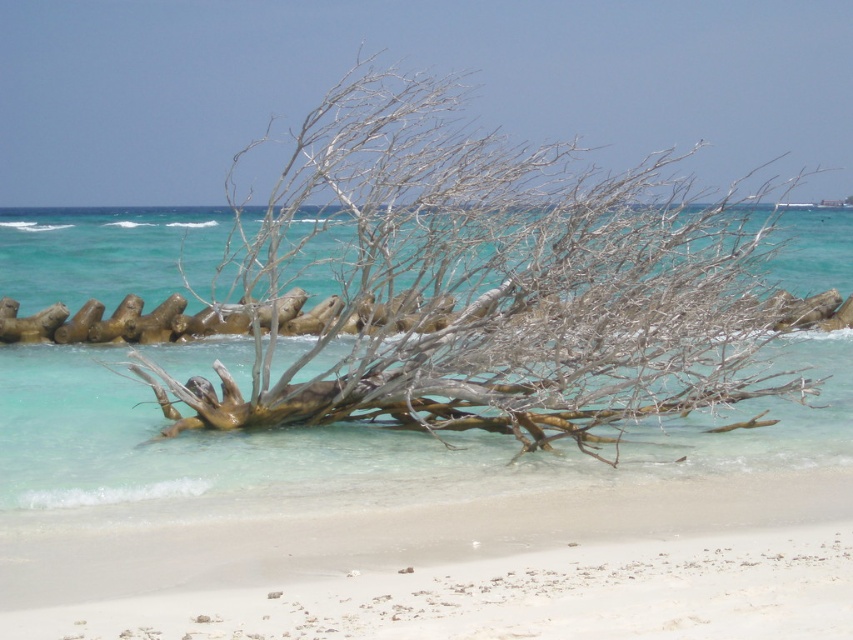
You are a lifeguard standing on the white sandy beach at lower center. You need to quickly reach the gray wood tree at center to retrieve a swimmer stranded there. Considering the width of the beach and the tree, can you safely walk directly to the tree without entering the water?

The gray wood tree at center is wider than the white sandy beach at lower center, so the tree likely extends beyond the beach area. Since the beach is narrower than the tree, walking directly to the tree may require stepping into the water where the beach ends. However, the tree is positioned at the waterline, so part of it might still be on the beach. You should check the exposed portion of the tree on the beach before proceeding.

You are standing on the beach and want to take a photo of the gray wood tree at center. If your camera has a maximum zoom range of 30 feet, will you need to move closer to the tree to capture it clearly?

The gray wood tree at center is 41.30 feet away from you. Since your camera can only zoom up to 30 feet, you will need to move closer to the tree to capture it clearly.